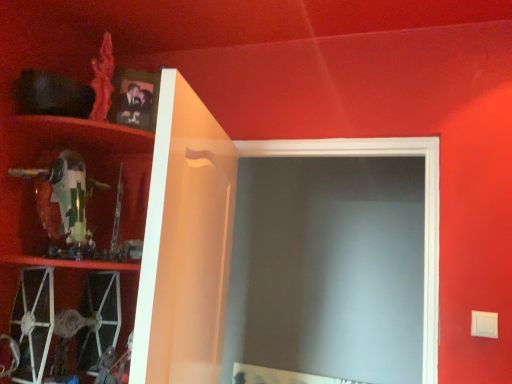
Question: Considering the relative positions of matte black photo frame at upper left and green plastic toy at left, placed as the second cabinet when sorted from left to right, in the image provided, is matte black photo frame at upper left to the right of green plastic toy at left, placed as the second cabinet when sorted from left to right, from the viewer's perspective?

Choices:
 (A) no
 (B) yes

Answer: (B)

Question: Is matte black photo frame at upper left at the left side of green plastic toy at left, placed as the second cabinet when sorted from left to right?

Choices:
 (A) no
 (B) yes

Answer: (A)

Question: Can you confirm if matte black photo frame at upper left is taller than green plastic toy at left, the 2th cabinet from the right?

Choices:
 (A) yes
 (B) no

Answer: (B)

Question: Is matte black photo frame at upper left bigger than green plastic toy at left, placed as the second cabinet when sorted from left to right?

Choices:
 (A) yes
 (B) no

Answer: (B)

Question: Is matte black photo frame at upper left thinner than green plastic toy at left, placed as the second cabinet when sorted from left to right?

Choices:
 (A) no
 (B) yes

Answer: (B)

Question: In the image, is white glossy cabinet at upper left, acting as the third cabinet starting from the left, on the left side or the right side of green plastic toy at left, the 2th cabinet from the right?

Choices:
 (A) right
 (B) left

Answer: (A)

Question: Is white glossy cabinet at upper left, which is the 1th cabinet from right to left, in front of or behind green plastic toy at left, the 2th cabinet from the right, in the image?

Choices:
 (A) behind
 (B) front

Answer: (B)

Question: From a real-world perspective, is white glossy cabinet at upper left, which is the 1th cabinet from right to left, positioned above or below green plastic toy at left, placed as the second cabinet when sorted from left to right?

Choices:
 (A) below
 (B) above

Answer: (A)

Question: Looking at the image, does white glossy cabinet at upper left, which is the 1th cabinet from right to left, seem bigger or smaller compared to green plastic toy at left, the 2th cabinet from the right?

Choices:
 (A) small
 (B) big

Answer: (B)

Question: In the image, is white glossy cabinet at upper left, which is the 1th cabinet from right to left, positioned in front of or behind matte black photo frame at upper left?

Choices:
 (A) behind
 (B) front

Answer: (B)

Question: Looking at their shapes, would you say white glossy cabinet at upper left, which is the 1th cabinet from right to left, is wider or thinner than matte black photo frame at upper left?

Choices:
 (A) wide
 (B) thin

Answer: (A)

Question: Do you think white glossy cabinet at upper left, which is the 1th cabinet from right to left, is within matte black photo frame at upper left, or outside of it?

Choices:
 (A) outside
 (B) inside

Answer: (A)

Question: From the image's perspective, is white glossy cabinet at upper left, acting as the third cabinet starting from the left, located above or below matte black photo frame at upper left?

Choices:
 (A) below
 (B) above

Answer: (A)

Question: In terms of width, does matte black photo frame at upper left look wider or thinner when compared to white glossy cabinet at upper left, which is the 1th cabinet from right to left?

Choices:
 (A) wide
 (B) thin

Answer: (B)

Question: Based on their positions, is matte black photo frame at upper left located to the left or right of white glossy cabinet at upper left, which is the 1th cabinet from right to left?

Choices:
 (A) right
 (B) left

Answer: (B)